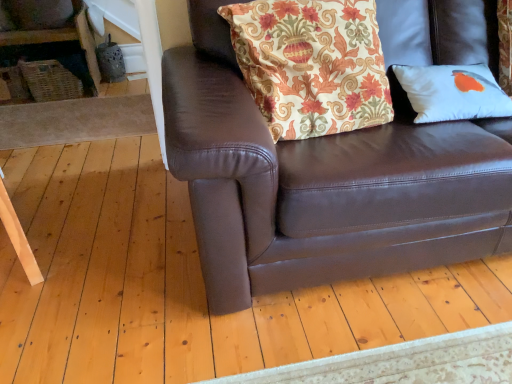
Question: Which direction should I rotate to look at floral fabric cushion at upper center, the 1th pillow positioned from the left, — up or down?

Choices:
 (A) up
 (B) down

Answer: (A)

Question: Is matte gray vase at upper left beside brown leather couch at center?

Choices:
 (A) yes
 (B) no

Answer: (B)

Question: From a real-world perspective, is matte gray vase at upper left positioned under brown leather couch at center based on gravity?

Choices:
 (A) yes
 (B) no

Answer: (B)

Question: Considering the relative sizes of matte gray vase at upper left and brown leather couch at center in the image provided, is matte gray vase at upper left thinner than brown leather couch at center?

Choices:
 (A) no
 (B) yes

Answer: (B)

Question: Does matte gray vase at upper left appear on the left side of brown leather couch at center?

Choices:
 (A) yes
 (B) no

Answer: (A)

Question: Is matte gray vase at upper left positioned in front of brown leather couch at center?

Choices:
 (A) no
 (B) yes

Answer: (A)

Question: Is matte gray vase at upper left to the right of brown leather couch at center from the viewer's perspective?

Choices:
 (A) no
 (B) yes

Answer: (A)

Question: Does matte gray vase at upper left have a smaller size compared to floral fabric cushion at upper center, the 2th pillow viewed from the right?

Choices:
 (A) yes
 (B) no

Answer: (A)

Question: Is matte gray vase at upper left positioned far away from floral fabric cushion at upper center, the 1th pillow positioned from the left?

Choices:
 (A) yes
 (B) no

Answer: (A)

Question: Would you say matte gray vase at upper left is outside floral fabric cushion at upper center, the 1th pillow positioned from the left?

Choices:
 (A) yes
 (B) no

Answer: (A)

Question: Does matte gray vase at upper left have a greater width compared to floral fabric cushion at upper center, the 2th pillow viewed from the right?

Choices:
 (A) yes
 (B) no

Answer: (B)

Question: Can you confirm if matte gray vase at upper left is shorter than floral fabric cushion at upper center, the 1th pillow positioned from the left?

Choices:
 (A) no
 (B) yes

Answer: (B)

Question: Can you confirm if matte gray vase at upper left is bigger than floral fabric cushion at upper center, the 2th pillow viewed from the right?

Choices:
 (A) no
 (B) yes

Answer: (A)

Question: From a real-world perspective, is brown leather couch at center positioned under matte gray vase at upper left based on gravity?

Choices:
 (A) yes
 (B) no

Answer: (A)